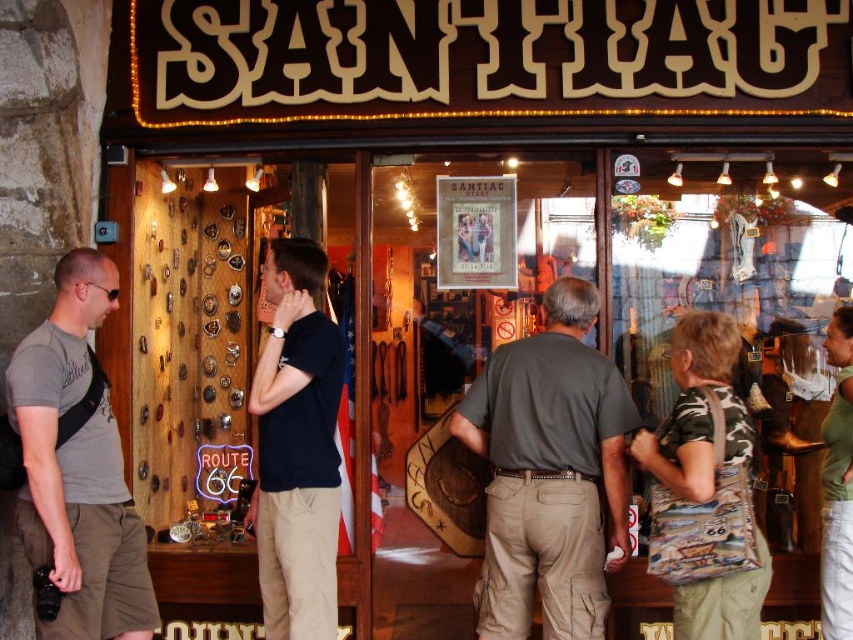
What is the location of the point with coordinates (77, 467) in the image?

The point with coordinates (77, 467) is on the gray fabric shirt at left.